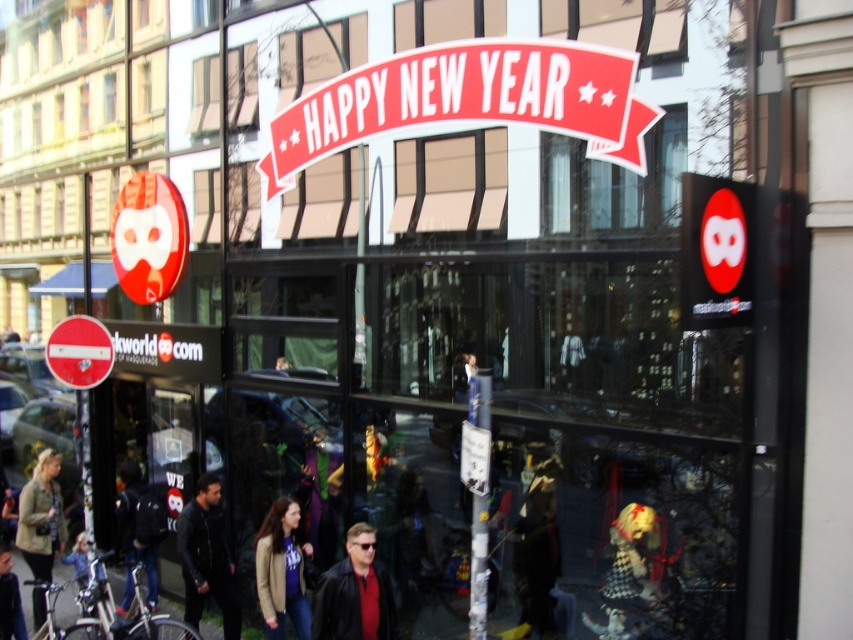
Question: Which point is closer to the camera?

Choices:
 (A) (78, 380)
 (B) (335, 598)
 (C) (619, 77)

Answer: (C)

Question: Where is matte black jacket at center located in relation to dark blue leather jacket at lower left in the image?

Choices:
 (A) below
 (B) above

Answer: (B)

Question: Where is khaki fabric jacket at lower left located in relation to red plastic circle at left in the image?

Choices:
 (A) right
 (B) left

Answer: (B)

Question: Does khaki fabric jacket at lower left come behind red plastic circle at left?

Choices:
 (A) no
 (B) yes

Answer: (A)

Question: Which point appears closest to the camera in this image?

Choices:
 (A) (99, 349)
 (B) (282, 550)

Answer: (B)

Question: Which point is closer to the camera?

Choices:
 (A) dark blue leather jacket at lower left
 (B) matte brown jacket at center
 (C) khaki fabric jacket at lower left
 (D) red plastic circle at left

Answer: (B)